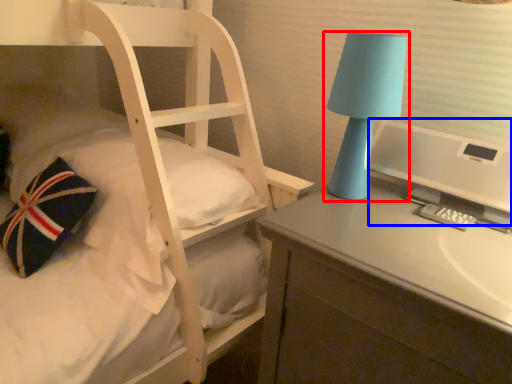
Question: Which object appears closest to the camera in this image, lamp (highlighted by a red box) or computer monitor (highlighted by a blue box)?

Choices:
 (A) lamp
 (B) computer monitor

Answer: (B)